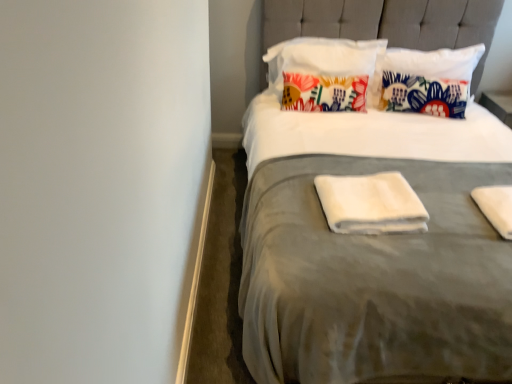
Find the location of `vacant space situated above white soft towel at center, arranged as the second material when viewed from the right (from a real-world perspective)`. vacant space situated above white soft towel at center, arranged as the second material when viewed from the right (from a real-world perspective) is located at coordinates (380, 188).